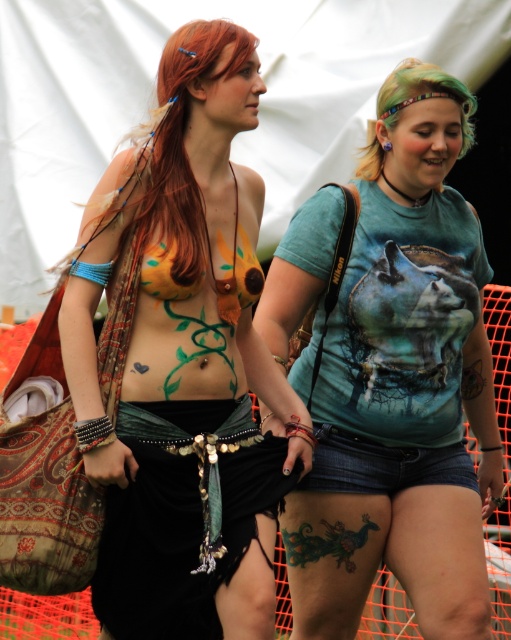
Is point (117, 417) farther from viewer compared to point (125, 416)?

No, it is not.

Measure the distance between matte body paint at center and black fabric skirt at center.

A distance of 36.57 inches exists between matte body paint at center and black fabric skirt at center.

Between point (201, 193) and point (254, 436), which one is positioned in front?

Point (201, 193) is more forward.

Where is `matte body paint at center`? This screenshot has height=640, width=511. matte body paint at center is located at coordinates (184, 364).

In the scene shown: Is blonde hair at upper center taller than green matte vine at center?

Correct, blonde hair at upper center is much taller as green matte vine at center.

Can you confirm if blonde hair at upper center is wider than green matte vine at center?

Yes.

Identify the location of blonde hair at upper center. The height and width of the screenshot is (640, 511). (182, 140).

The image size is (511, 640). Identify the location of blonde hair at upper center. (182, 140).

The width and height of the screenshot is (511, 640). What do you see at coordinates (182, 140) in the screenshot?
I see `blonde hair at upper center` at bounding box center [182, 140].

Which is behind, point (178, 204) or point (286, 548)?

The point (286, 548) is behind.

Does point (188, 280) lie in front of point (295, 561)?

Yes.

Where is `blonde hair at upper center`? blonde hair at upper center is located at coordinates (182, 140).